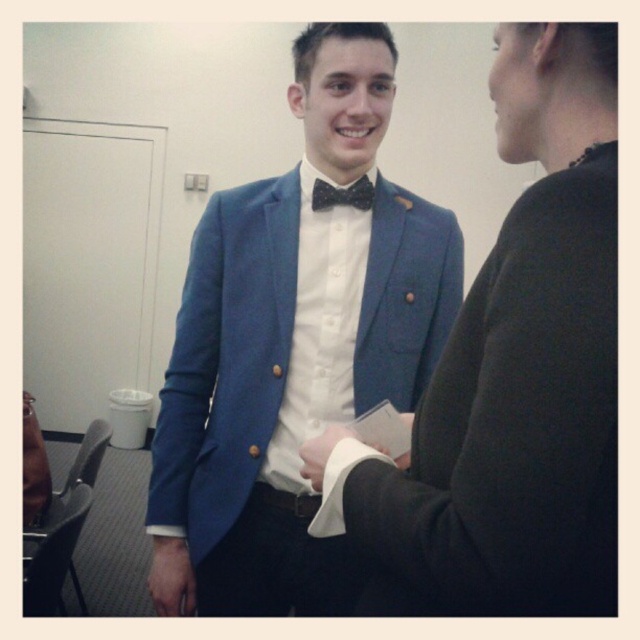
Question: Which of the following is the closest to the observer?

Choices:
 (A) matte blue suit at center
 (B) black satin bow tie at center

Answer: (A)

Question: Is matte blue suit at center thinner than black satin bow tie at center?

Choices:
 (A) yes
 (B) no

Answer: (B)

Question: Is matte blue suit at center closer to camera compared to matte blue blazer at center?

Choices:
 (A) yes
 (B) no

Answer: (B)

Question: Among these points, which one is nearest to the camera?

Choices:
 (A) (561, 234)
 (B) (273, 451)
 (C) (330, 188)

Answer: (A)

Question: Does matte blue suit at center have a larger size compared to black satin bow tie at center?

Choices:
 (A) yes
 (B) no

Answer: (A)

Question: Which object is closer to the camera taking this photo?

Choices:
 (A) matte blue blazer at center
 (B) black satin bow tie at center
 (C) matte blue suit at center

Answer: (A)